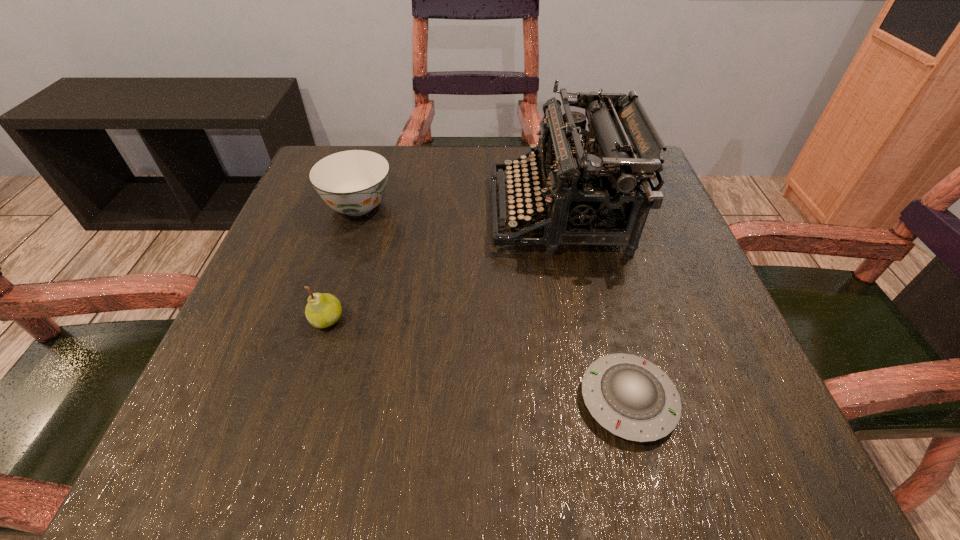
The width and height of the screenshot is (960, 540). I want to click on free area in between the third farthest object and the soup bowl, so click(x=343, y=262).

Locate an element on the screen. This screenshot has height=540, width=960. vacant area that lies between the nearest object and the soup bowl is located at coordinates coord(493,303).

This screenshot has height=540, width=960. Identify the location of vacant area that lies between the third farthest object and the nearest object. [478, 360].

This screenshot has width=960, height=540. What are the coordinates of `free space between the second nearest object and the soup bowl` in the screenshot? It's located at (343, 262).

I want to click on unoccupied position between the soup bowl and the third farthest object, so click(343, 262).

Point out which object is positioned as the nearest to the pear. Please provide its 2D coordinates. Your answer should be formatted as a tuple, i.e. [(x, y)], where the tuple contains the x and y coordinates of a point satisfying the conditions above.

[(353, 182)]

Where is `object that stands as the second closest to the soup bowl`? This screenshot has height=540, width=960. object that stands as the second closest to the soup bowl is located at coordinates (597, 188).

Where is `free point that satisfies the following two spatial constraints: 1. on the typing side of the saucer; 2. on the left side of the typewriter`? Image resolution: width=960 pixels, height=540 pixels. free point that satisfies the following two spatial constraints: 1. on the typing side of the saucer; 2. on the left side of the typewriter is located at coordinates (596, 400).

At what (x,y) coordinates should I click in order to perform the action: click on free point that satisfies the following two spatial constraints: 1. on the front side of the second nearest object; 2. on the right side of the nearest object. Please return your answer as a coordinate pair (x, y). This screenshot has height=540, width=960. Looking at the image, I should click on (302, 400).

Locate an element on the screen. free location that satisfies the following two spatial constraints: 1. on the front side of the saucer; 2. on the left side of the soup bowl is located at coordinates (297, 400).